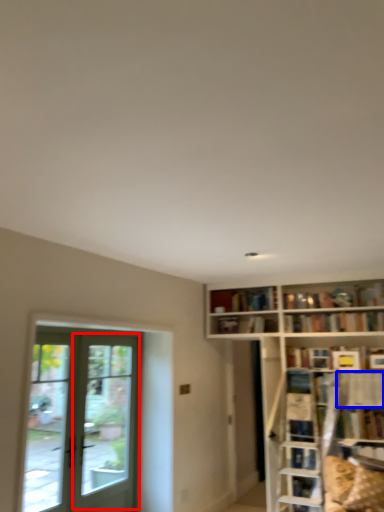
Question: Which point is closer to the camera, screen door (highlighted by a red box) or shelf (highlighted by a blue box)?

Choices:
 (A) screen door
 (B) shelf

Answer: (A)